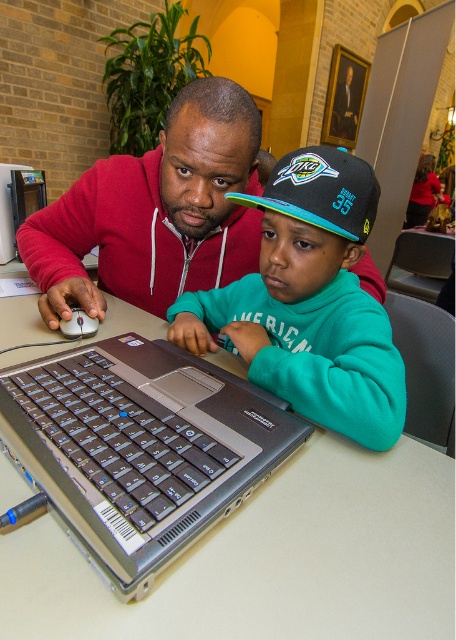
You are a photographer setting up a tripod to take a closeup of the blue and teal fabric baseball cap at center and the matte black mouse at left. The tripod has a height adjustment range of 10cm to 30cm. Based on the scene description, will you need to adjust the tripod to its maximum height to capture both objects in focus?

The blue and teal fabric baseball cap at center is taller than the matte black mouse at left. Since the tripod can be adjusted up to 30cm, and the height difference between the two objects is within this range, you can set the tripod to an appropriate height that accommodates both without needing the maximum height.

You are a designer working on a new line of accessories. You need to determine which object has a greater width for a size comparison study between the blue and teal fabric baseball cap at center and the matte black mouse at left. Which one is wider?

The blue and teal fabric baseball cap at center has a greater width than the matte black mouse at left according to the description provided.

You are a photographer setting up a shoot. You need to place a new camera on the table between the silver metallic laptop at center and the blue and teal fabric baseball cap at center. Based on their current positions, which object should the camera be placed to the right of?

The camera should be placed to the right of the silver metallic laptop at center because it is positioned to the left of the blue and teal fabric baseball cap at center.